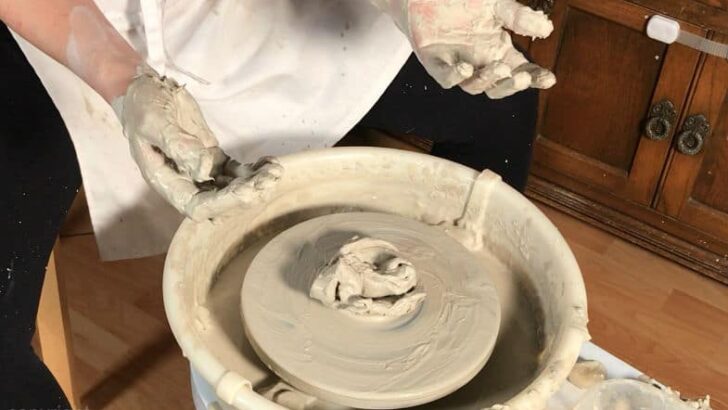
Image resolution: width=728 pixels, height=410 pixels. Find the location of `childproof lock`. childproof lock is located at coordinates (660, 34).